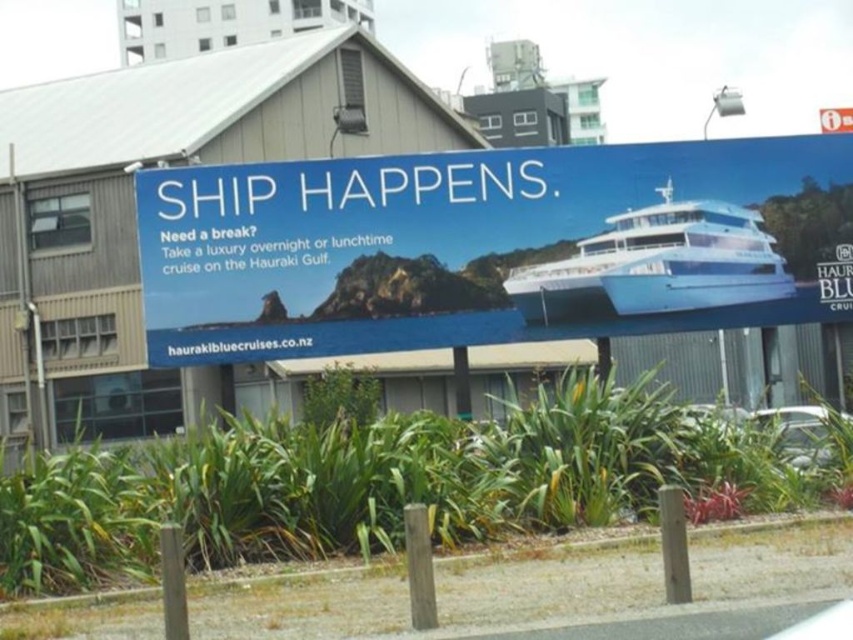
Question: Among these objects, which one is nearest to the camera?

Choices:
 (A) white glossy ship at upper center
 (B) white glossy boat at upper right

Answer: (A)

Question: Which object is closer to the camera taking this photo?

Choices:
 (A) white glossy boat at upper right
 (B) white glossy ship at upper center

Answer: (B)

Question: Observing the image, what is the correct spatial positioning of white glossy ship at upper center in reference to white glossy boat at upper right?

Choices:
 (A) right
 (B) left

Answer: (B)

Question: Is white glossy ship at upper center further to the viewer compared to white glossy boat at upper right?

Choices:
 (A) no
 (B) yes

Answer: (A)

Question: Can you confirm if white glossy ship at upper center is smaller than white glossy boat at upper right?

Choices:
 (A) yes
 (B) no

Answer: (B)